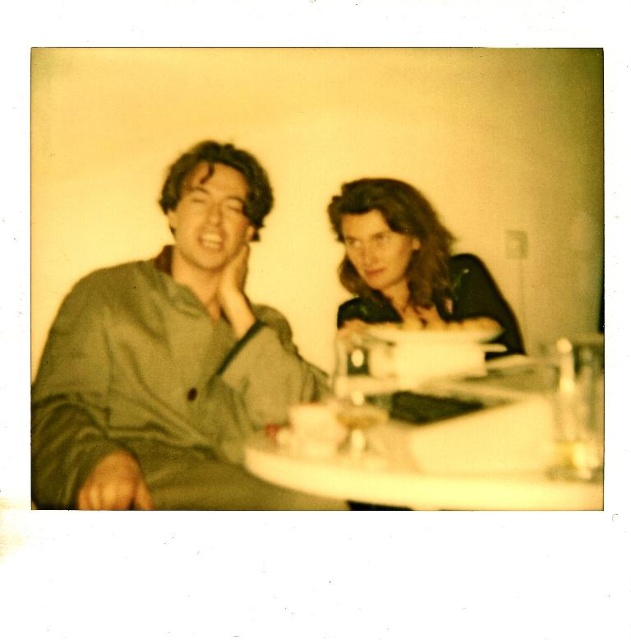
Question: Does green matte shirt at left lie in front of white glossy table at center?

Choices:
 (A) yes
 (B) no

Answer: (B)

Question: Estimate the real-world distances between objects in this image. Which object is farther from the white glossy table at center?

Choices:
 (A) matte black shirt at center
 (B) green matte shirt at left

Answer: (B)

Question: From the image, what is the correct spatial relationship of white glossy table at center in relation to matte black shirt at center?

Choices:
 (A) below
 (B) above

Answer: (A)

Question: Estimate the real-world distances between objects in this image. Which object is closer to the matte black shirt at center?

Choices:
 (A) green matte shirt at left
 (B) white glossy table at center

Answer: (B)

Question: Can you confirm if green matte shirt at left is wider than white glossy table at center?

Choices:
 (A) yes
 (B) no

Answer: (B)

Question: Considering the real-world distances, which object is closest to the matte black shirt at center?

Choices:
 (A) white glossy table at center
 (B) green matte shirt at left

Answer: (A)